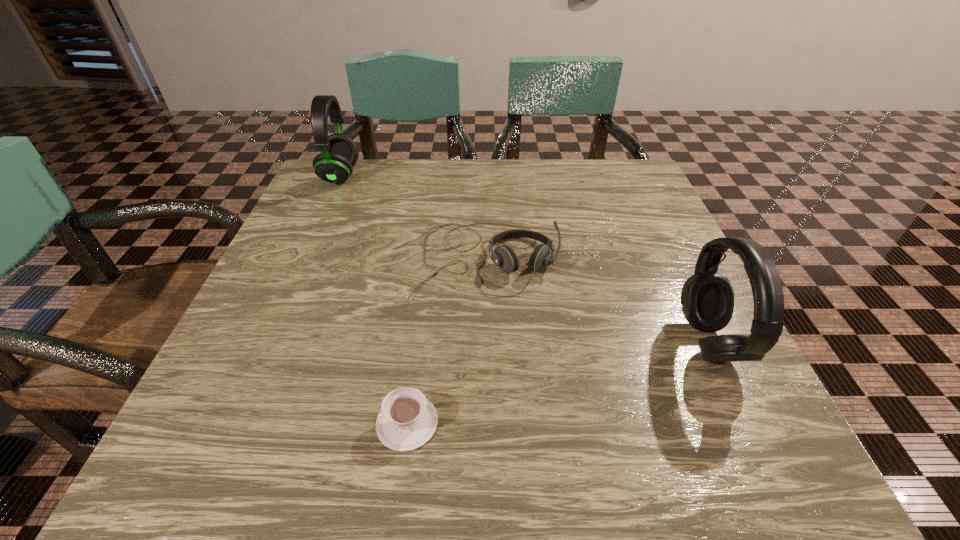
Identify which headset is the closest to the leftmost headset. Please provide its 2D coordinates. Your answer should be formatted as a tuple, i.e. [(x, y)], where the tuple contains the x and y coordinates of a point satisfying the conditions above.

[(503, 256)]

At what (x,y) coordinates should I click in order to perform the action: click on free region that satisfies the following two spatial constraints: 1. on the outer surface of the second headset from left to right; 2. on the handle side of the nearest object. Please return your answer as a coordinate pair (x, y). Looking at the image, I should click on (487, 423).